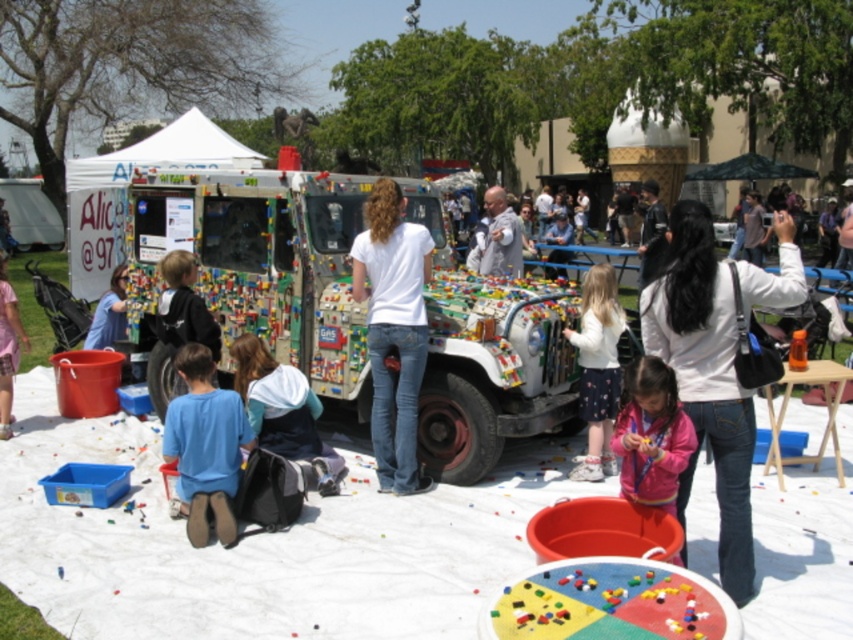
Which is more to the left, white matte jacket at upper right or white matte shirt at center?

From the viewer's perspective, white matte shirt at center appears more on the left side.

Is point (648, 317) closer to viewer compared to point (390, 259)?

That is True.

Measure the distance between white matte jacket at upper right and camera.

12.34 feet

You are a GUI agent. You are given a task and a screenshot of the screen. Output one action in this format:
    pyautogui.click(x=<x>, y=<y>)
    Task: Click on the white matte jacket at upper right
    The width and height of the screenshot is (853, 640).
    Given the screenshot: What is the action you would take?
    pyautogui.click(x=706, y=378)

Is white matte jacket at upper right wider than multicolored plastic lego pieces at center?

In fact, white matte jacket at upper right might be narrower than multicolored plastic lego pieces at center.

The width and height of the screenshot is (853, 640). What do you see at coordinates (706, 378) in the screenshot?
I see `white matte jacket at upper right` at bounding box center [706, 378].

Identify the location of white matte jacket at upper right. (706, 378).

Is brick-patterned plastic food truck at center thinner than blue denim jeans at lower left?

In fact, brick-patterned plastic food truck at center might be wider than blue denim jeans at lower left.

At what (x,y) coordinates should I click in order to perform the action: click on brick-patterned plastic food truck at center. Please return your answer as a coordinate pair (x, y). Looking at the image, I should click on (256, 269).

Locate an element on the screen. The image size is (853, 640). brick-patterned plastic food truck at center is located at coordinates (256, 269).